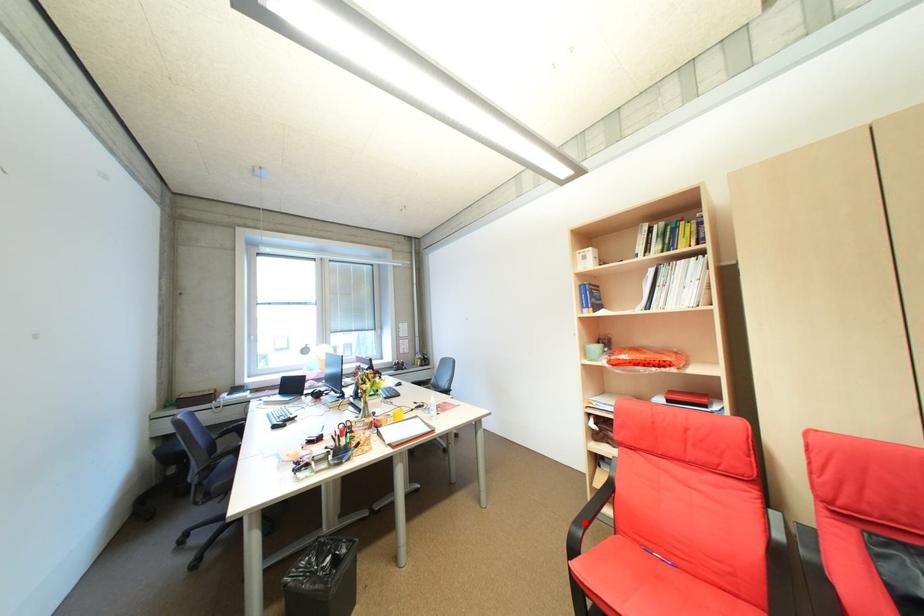
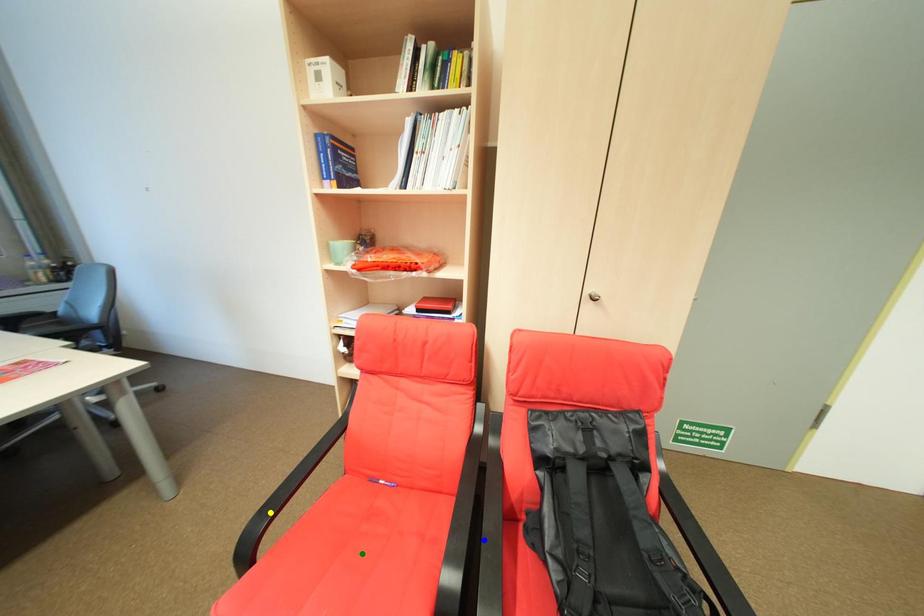
Question: I am providing you with two images of the same scene from different viewpoints. A red point is marked on the first image. You are given multiple points on the second image. Which point in image 2 is actually the same real-world point as the red point in image 1?

Choices:
 (A) blue point
 (B) yellow point
 (C) green point

Answer: (B)